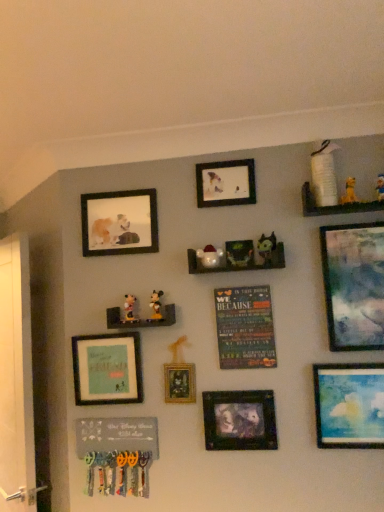
Describe the element at coordinates (119, 223) in the screenshot. This screenshot has height=512, width=384. I see `matte wooden picture frame at upper left, positioned as the 2th picture frame in left-to-right order` at that location.

Where is `matte green plush toy at upper center, which is counted as the 4th toy, starting from the left`? matte green plush toy at upper center, which is counted as the 4th toy, starting from the left is located at coordinates (267, 248).

The height and width of the screenshot is (512, 384). Describe the element at coordinates (380, 187) in the screenshot. I see `yellow plush toy at upper right, the first toy when ordered from top to bottom` at that location.

The width and height of the screenshot is (384, 512). I want to click on plastic mickey mouse figurines at center, the 3th shelf in the right-to-left sequence, so click(x=140, y=319).

Identify the location of matte wooden picture frame at upper left, positioned as the 6th picture frame in right-to-left order. (119, 223).

Based on their positions, is white wooden screen door at left located to the left or right of yellow plush toy at upper right, which is the second toy in top-to-bottom order?

Clearly, white wooden screen door at left is on the left of yellow plush toy at upper right, which is the second toy in top-to-bottom order, in the image.

Considering the points (0, 246) and (346, 179), which point is in front, point (0, 246) or point (346, 179)?

The point (346, 179) is more forward.

Where is `the 5th toy above the white wooden screen door at left (from the image's perspective)`? the 5th toy above the white wooden screen door at left (from the image's perspective) is located at coordinates (349, 192).

Is white wooden screen door at left oriented away from yellow plush toy at upper right, the fifth toy ordered from the bottom?

white wooden screen door at left is not turned away from yellow plush toy at upper right, the fifth toy ordered from the bottom.

Is matte glass painting at upper right, arranged as the 7th picture frame when viewed from the left, aimed at white wooden screen door at left?

No.

How many degrees apart are the facing directions of matte glass painting at upper right, acting as the 1th picture frame starting from the right, and white wooden screen door at left?

They differ by 41.7 degrees in their facing directions.

Does matte glass painting at upper right, arranged as the 7th picture frame when viewed from the left, have a smaller size compared to white wooden screen door at left?

Indeed, matte glass painting at upper right, arranged as the 7th picture frame when viewed from the left, has a smaller size compared to white wooden screen door at left.

Between matte glass painting at upper right, acting as the 1th picture frame starting from the right, and white wooden screen door at left, which one has less height?

With less height is matte glass painting at upper right, acting as the 1th picture frame starting from the right.

Considering the relative positions of white wooden screen door at left and yellow plastic mickey mouse at center, arranged as the 2th toy when viewed from the left, in the image provided, is white wooden screen door at left to the right of yellow plastic mickey mouse at center, arranged as the 2th toy when viewed from the left, from the viewer's perspective?

Incorrect, white wooden screen door at left is not on the right side of yellow plastic mickey mouse at center, arranged as the 2th toy when viewed from the left.

Identify the location of screen door directly beneath the yellow plastic mickey mouse at center, positioned as the 5th toy in top-to-bottom order (from a real-world perspective). (16, 380).

Considering the relative sizes of white wooden screen door at left and yellow plastic mickey mouse at center, positioned as the 5th toy in top-to-bottom order, in the image provided, is white wooden screen door at left thinner than yellow plastic mickey mouse at center, positioned as the 5th toy in top-to-bottom order,?

No.

Is white wooden screen door at left oriented away from yellow plastic mickey mouse at center, positioned as the 5th toy in top-to-bottom order?

That's not correct — white wooden screen door at left is not looking away from yellow plastic mickey mouse at center, positioned as the 5th toy in top-to-bottom order.

Is yellow plush toy at upper right, the first toy when ordered from top to bottom, positioned before matte plastic santa at center, which is counted as the third toy, starting from the left?

Yes, yellow plush toy at upper right, the first toy when ordered from top to bottom, is in front of matte plastic santa at center, which is counted as the third toy, starting from the left.

Does yellow plush toy at upper right, the 6th toy positioned from the left, have a larger size compared to matte plastic santa at center, which ranks as the third toy in bottom-to-top order?

No, yellow plush toy at upper right, the 6th toy positioned from the left, is not bigger than matte plastic santa at center, which ranks as the third toy in bottom-to-top order.

Is yellow plush toy at upper right, which is the first toy from right to left, oriented towards matte plastic santa at center, which is counted as the 4th toy, starting from the right?

No, yellow plush toy at upper right, which is the first toy from right to left, is not facing towards matte plastic santa at center, which is counted as the 4th toy, starting from the right.

Considering the sizes of objects yellow plush toy at upper right, the 6th toy positioned from the left, and matte plastic santa at center, which is counted as the third toy, starting from the left, in the image provided, who is taller, yellow plush toy at upper right, the 6th toy positioned from the left, or matte plastic santa at center, which is counted as the third toy, starting from the left,?

yellow plush toy at upper right, the 6th toy positioned from the left.

Is matte black picture frame at upper center, the fourth picture frame from the left, far from multicolored fabric poster at center?

matte black picture frame at upper center, the fourth picture frame from the left, is near multicolored fabric poster at center, not far away.

Could you tell me if matte black picture frame at upper center, arranged as the fourth picture frame when viewed from the right, is turned towards multicolored fabric poster at center?

No.

From a real-world perspective, is matte black picture frame at upper center, arranged as the fourth picture frame when viewed from the right, over multicolored fabric poster at center?

Yes, from a real-world perspective, matte black picture frame at upper center, arranged as the fourth picture frame when viewed from the right, is above multicolored fabric poster at center.

From the image's perspective, is matte black picture frame at upper center, arranged as the fourth picture frame when viewed from the right, beneath multicolored fabric poster at center?

No.

From the image's perspective, is matte wooden picture frame at upper left, positioned as the 6th picture frame in right-to-left order, below white wooden screen door at left?

Incorrect, from the image's perspective, matte wooden picture frame at upper left, positioned as the 6th picture frame in right-to-left order, is higher than white wooden screen door at left.

What's the angular difference between matte wooden picture frame at upper left, positioned as the 6th picture frame in right-to-left order, and white wooden screen door at left's facing directions?

There is a 43.6-degree angle between the facing directions of matte wooden picture frame at upper left, positioned as the 6th picture frame in right-to-left order, and white wooden screen door at left.

Can you confirm if matte wooden picture frame at upper left, positioned as the 2th picture frame in left-to-right order, is smaller than white wooden screen door at left?

Yes, matte wooden picture frame at upper left, positioned as the 2th picture frame in left-to-right order, is smaller than white wooden screen door at left.

From a real-world perspective, which object rests below the other?

white wooden screen door at left, from a real-world perspective.

From a real-world perspective, between wooden shelf at center, which is the 2th shelf in left-to-right order, and white wooden screen door at left, who is vertically higher?

In real-world perspective, wooden shelf at center, which is the 2th shelf in left-to-right order, is above.

Is wooden shelf at center, which appears as the 2th shelf when viewed from the top, facing away from white wooden screen door at left?

wooden shelf at center, which appears as the 2th shelf when viewed from the top, is not turned away from white wooden screen door at left.

How different are the orientations of wooden shelf at center, which is the 2th shelf in left-to-right order, and white wooden screen door at left in degrees?

The facing directions of wooden shelf at center, which is the 2th shelf in left-to-right order, and white wooden screen door at left are 44.5 degrees apart.

From the image's perspective, would you say wooden shelf at center, which is the 2th shelf in left-to-right order, is shown under white wooden screen door at left?

Actually, wooden shelf at center, which is the 2th shelf in left-to-right order, appears above white wooden screen door at left in the image.

You are a GUI agent. You are given a task and a screenshot of the screen. Output one action in this format:
    pyautogui.click(x=<x>, y=<y>)
    Task: Click on the screen door below the yellow plush toy at upper right, which is the fifth toy from left to right (from a real-world perspective)
    The image size is (384, 512).
    Given the screenshot: What is the action you would take?
    pyautogui.click(x=16, y=380)

Identify the location of the 7th picture frame to the right of the white wooden screen door at left, counting from the anchor's position. Image resolution: width=384 pixels, height=512 pixels. (354, 285).

Estimate the real-world distances between objects in this image. Which object is further from multicolored fabric poster at center, matte blue painting at lower right, which is the second picture frame in right-to-left order, or matte plastic mickey mouse at center, positioned as the sixth toy in right-to-left order?

The object further to multicolored fabric poster at center is matte plastic mickey mouse at center, positioned as the sixth toy in right-to-left order.

When comparing their distances from matte wooden picture frame at upper left, positioned as the 2th picture frame in left-to-right order, does yellow plush toy at upper right, which is the fifth toy from left to right, or wooden shelf at center, the second shelf viewed from the right, seem further?

The object further to matte wooden picture frame at upper left, positioned as the 2th picture frame in left-to-right order, is yellow plush toy at upper right, which is the fifth toy from left to right.

Based on their spatial positions, is multicolored fabric poster at center or matte glass painting at upper right, acting as the 1th picture frame starting from the right, further from yellow plush toy at upper right, which is the first toy from right to left?

Among the two, multicolored fabric poster at center is located further to yellow plush toy at upper right, which is the first toy from right to left.

Estimate the real-world distances between objects in this image. Which object is further from matte blue painting at lower right, marked as the sixth picture frame in a left-to-right arrangement, multicolored fabric poster at center or white wooden screen door at left?

white wooden screen door at left is further to matte blue painting at lower right, marked as the sixth picture frame in a left-to-right arrangement.

Based on their spatial positions, is matte plastic mickey mouse at center, positioned as the sixth toy in right-to-left order, or matte glass painting at upper right, acting as the 1th picture frame starting from the right, closer to multicolored fabric poster at center?

matte glass painting at upper right, acting as the 1th picture frame starting from the right, lies closer to multicolored fabric poster at center than the other object.

From the image, which object appears to be nearer to yellow plush toy at upper right, positioned as the second toy in right-to-left order, matte green frame at center-left, which ranks as the 7th picture frame in right-to-left order, or matte green plush toy at upper center, which is counted as the 4th toy, starting from the left?

matte green plush toy at upper center, which is counted as the 4th toy, starting from the left, is closer to yellow plush toy at upper right, positioned as the second toy in right-to-left order.

Looking at the image, which one is located further to yellow plush toy at upper right, which is the fifth toy from left to right, yellow plush toy at upper right, the first toy when ordered from top to bottom, or matte blue painting at lower right, which is the second picture frame in right-to-left order?

matte blue painting at lower right, which is the second picture frame in right-to-left order, lies further to yellow plush toy at upper right, which is the fifth toy from left to right, than the other object.

Based on their spatial positions, is matte plastic mickey mouse at center, acting as the 1th toy starting from the left, or matte green plush toy at upper center, which is counted as the 4th toy, starting from the left, closer to yellow plush toy at upper right, the first toy when ordered from top to bottom?

matte green plush toy at upper center, which is counted as the 4th toy, starting from the left, lies closer to yellow plush toy at upper right, the first toy when ordered from top to bottom, than the other object.

I want to click on shelf between matte plastic mickey mouse at center, acting as the 1th toy starting from the left, and gold metallic picture frame at center, marked as the 5th picture frame in a right-to-left arrangement, in the up-down direction, so click(x=140, y=319).

Where is `bulletin board between gold metallic picture frame at center, which is the 3th picture frame from left to right, and matte glass painting at upper right, arranged as the 7th picture frame when viewed from the left, in the horizontal direction`? This screenshot has width=384, height=512. bulletin board between gold metallic picture frame at center, which is the 3th picture frame from left to right, and matte glass painting at upper right, arranged as the 7th picture frame when viewed from the left, in the horizontal direction is located at coordinates (245, 327).

The image size is (384, 512). What are the coordinates of `shelf between matte wooden picture frame at upper left, positioned as the 6th picture frame in right-to-left order, and wooden shelf at center, which appears as the 2th shelf when viewed from the top` in the screenshot? It's located at (140, 319).

Where is `bulletin board between white wooden screen door at left and matte blue painting at lower right, marked as the sixth picture frame in a left-to-right arrangement, in the horizontal direction`? bulletin board between white wooden screen door at left and matte blue painting at lower right, marked as the sixth picture frame in a left-to-right arrangement, in the horizontal direction is located at coordinates (245, 327).